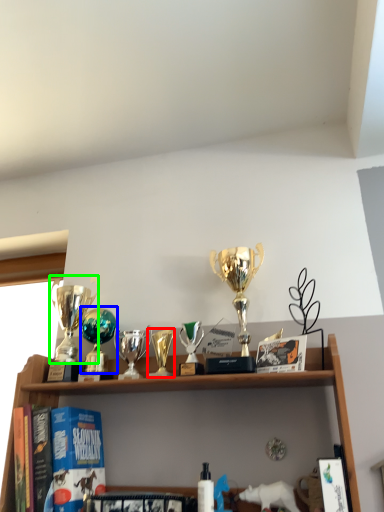
Question: Estimate the real-world distances between objects in this image. Which object is farther from candle holder (highlighted by a red box), trophy (highlighted by a blue box) or trophy (highlighted by a green box)?

Choices:
 (A) trophy
 (B) trophy

Answer: (B)